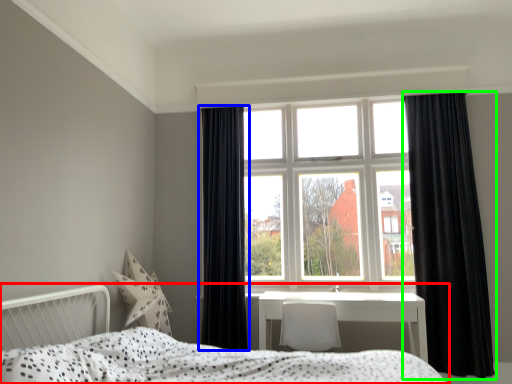
Question: Which object is positioned farthest from bed (highlighted by a red box)? Select from curtain (highlighted by a blue box) and curtain (highlighted by a green box).

Choices:
 (A) curtain
 (B) curtain

Answer: (B)